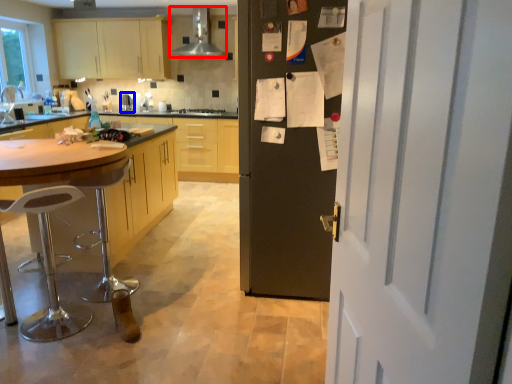
Question: Which of the following is the closest to the observer, kitchen appliance (highlighted by a red box) or appliance (highlighted by a blue box)?

Choices:
 (A) kitchen appliance
 (B) appliance

Answer: (A)